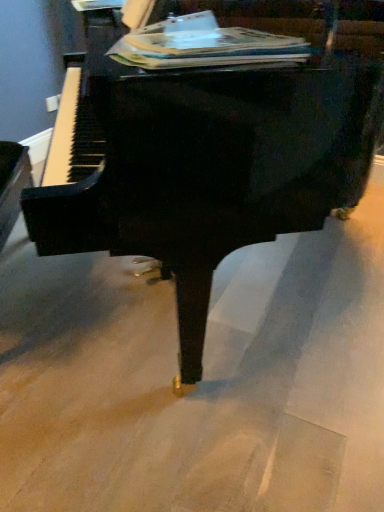
Question: Is paperback book at upper center taller or shorter than black polished piano at center?

Choices:
 (A) short
 (B) tall

Answer: (A)

Question: Is paperback book at upper center wider or thinner than black polished piano at center?

Choices:
 (A) wide
 (B) thin

Answer: (B)

Question: Is point (238, 60) closer or farther from the camera than point (69, 161)?

Choices:
 (A) farther
 (B) closer

Answer: (B)

Question: Is black polished piano at center in front of or behind paperback book at upper center in the image?

Choices:
 (A) behind
 (B) front

Answer: (B)

Question: From a real-world perspective, is black polished piano at center positioned above or below paperback book at upper center?

Choices:
 (A) above
 (B) below

Answer: (B)

Question: Considering the positions of point (127, 65) and point (147, 38), is point (127, 65) closer or farther from the camera than point (147, 38)?

Choices:
 (A) farther
 (B) closer

Answer: (B)

Question: In terms of width, does black polished piano at center look wider or thinner when compared to paperback book at upper center?

Choices:
 (A) thin
 (B) wide

Answer: (B)